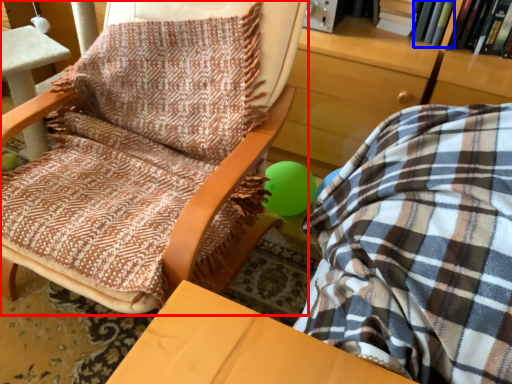
Question: Which point is closer to the camera, chair (highlighted by a red box) or book (highlighted by a blue box)?

Choices:
 (A) chair
 (B) book

Answer: (A)